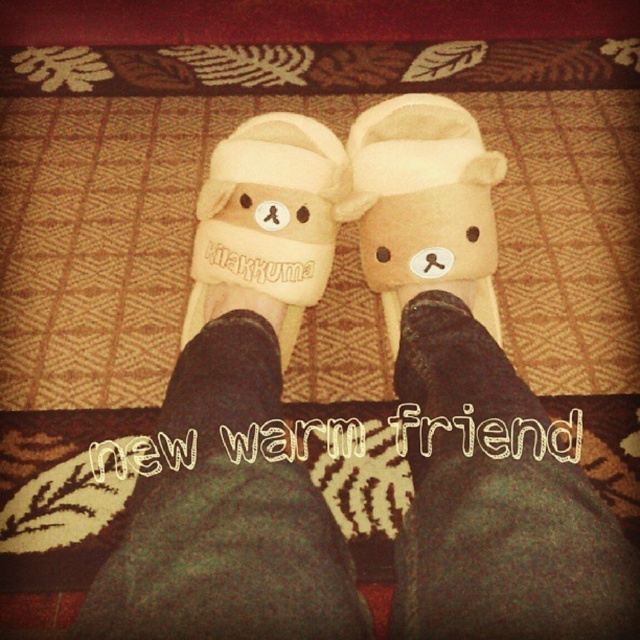
Question: Among these objects, which one is farthest from the camera?

Choices:
 (A) beige soft plush bear slipper at center
 (B) beige fabric slipper at center

Answer: (B)

Question: Does beige soft plush bear slipper at center have a greater width compared to beige fabric slipper at center?

Choices:
 (A) yes
 (B) no

Answer: (B)

Question: Does beige soft plush bear slipper at center appear on the right side of beige fabric slipper at center?

Choices:
 (A) yes
 (B) no

Answer: (A)

Question: Which of the following is the farthest from the observer?

Choices:
 (A) beige soft plush bear slipper at center
 (B) beige fabric slipper at center

Answer: (B)

Question: Which of the following is the farthest from the observer?

Choices:
 (A) beige soft plush bear slipper at center
 (B) beige fabric slipper at center

Answer: (B)

Question: Is beige soft plush bear slipper at center bigger than beige fabric slipper at center?

Choices:
 (A) yes
 (B) no

Answer: (B)